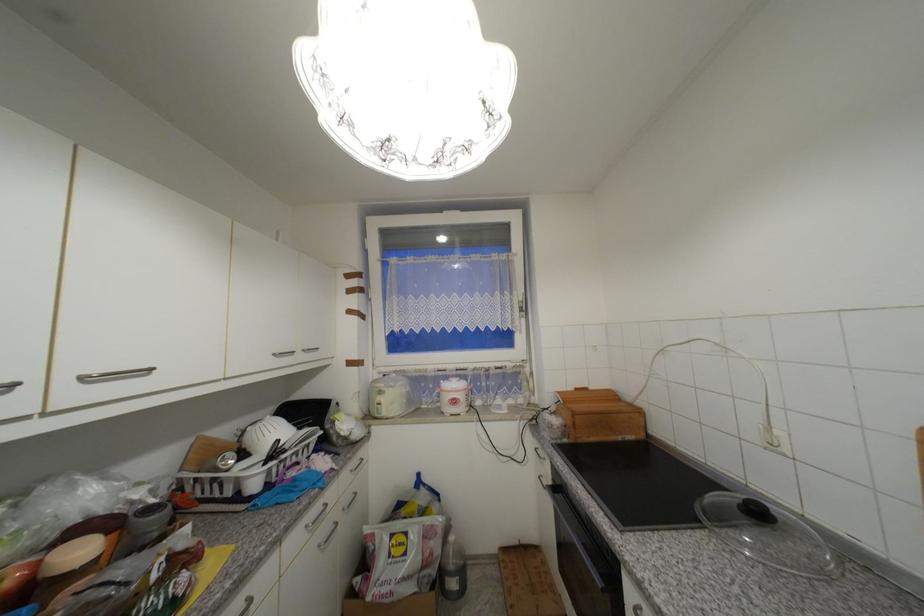
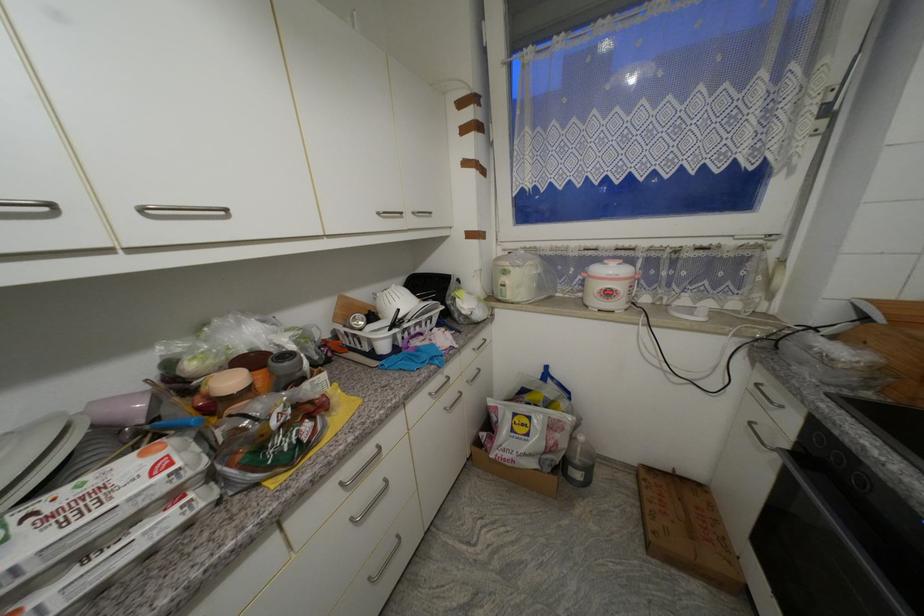
Find the pixel in the second image that matches point 157,519 in the first image.

(292, 365)